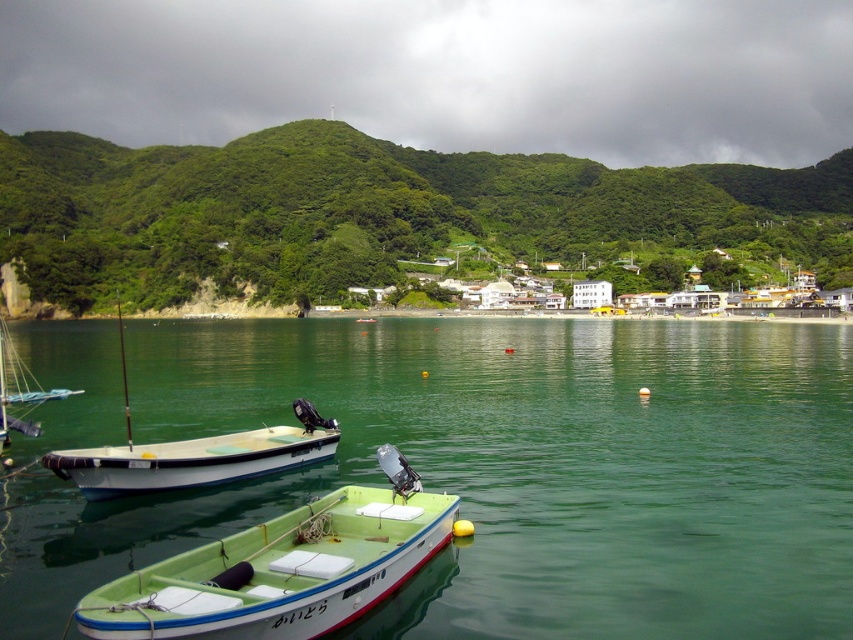
Question: Is green leafy hillside at center behind white matte boat at center?

Choices:
 (A) yes
 (B) no

Answer: (A)

Question: Which object is positioned farthest from the green smooth water at center?

Choices:
 (A) white matte boat at center
 (B) green plastic boat at center

Answer: (A)

Question: Which object is farther from the camera taking this photo?

Choices:
 (A) green smooth water at center
 (B) green leafy hillside at center

Answer: (B)

Question: Is green smooth water at center bigger than white matte boat at center?

Choices:
 (A) no
 (B) yes

Answer: (B)

Question: Among these points, which one is nearest to the camera?

Choices:
 (A) (199, 468)
 (B) (393, 486)
 (C) (347, 243)
 (D) (67, 332)

Answer: (B)

Question: Is green smooth water at center above green leafy hillside at center?

Choices:
 (A) yes
 (B) no

Answer: (B)